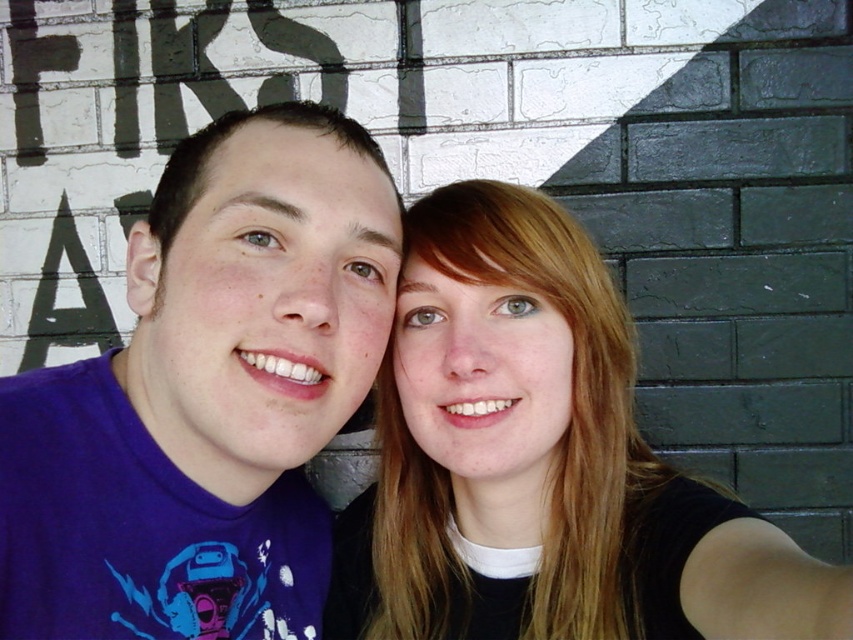
Question: Which object is farther from the camera taking this photo?

Choices:
 (A) purple t-shirt at left
 (B) smooth blonde hair at center

Answer: (A)

Question: Which of the following is the farthest from the observer?

Choices:
 (A) purple t-shirt at left
 (B) smooth blonde hair at center

Answer: (A)

Question: Can you confirm if purple t-shirt at left is positioned to the left of smooth blonde hair at center?

Choices:
 (A) no
 (B) yes

Answer: (B)

Question: Does purple t-shirt at left appear on the left side of smooth blonde hair at center?

Choices:
 (A) no
 (B) yes

Answer: (B)

Question: Can you confirm if purple t-shirt at left is positioned to the left of smooth blonde hair at center?

Choices:
 (A) yes
 (B) no

Answer: (A)